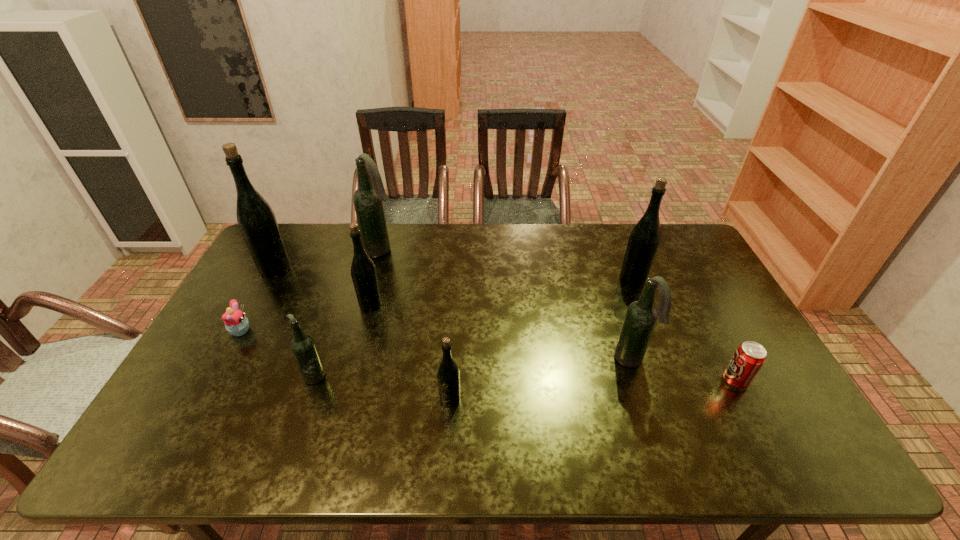
The image size is (960, 540). Identify the location of the tallest beer bottle. (256, 220).

Identify the location of the leftmost beer bottle. The image size is (960, 540). (256, 220).

This screenshot has width=960, height=540. I want to click on the rightmost green beer bottle, so click(643, 242).

Identify the location of the second object from right to left. The height and width of the screenshot is (540, 960). (643, 242).

The width and height of the screenshot is (960, 540). Identify the location of the biggest dark beer bottle. (368, 199).

This screenshot has height=540, width=960. In order to click on the third biggest green beer bottle in this screenshot , I will do [363, 270].

Identify the location of the fourth farthest beer bottle. click(x=363, y=270).

Where is `the seventh object from left to right`? The width and height of the screenshot is (960, 540). the seventh object from left to right is located at coordinates (641, 316).

Find the location of a particular element. the second smallest dark beer bottle is located at coordinates (641, 316).

Image resolution: width=960 pixels, height=540 pixels. Find the location of `the smallest dark beer bottle`. the smallest dark beer bottle is located at coordinates (303, 347).